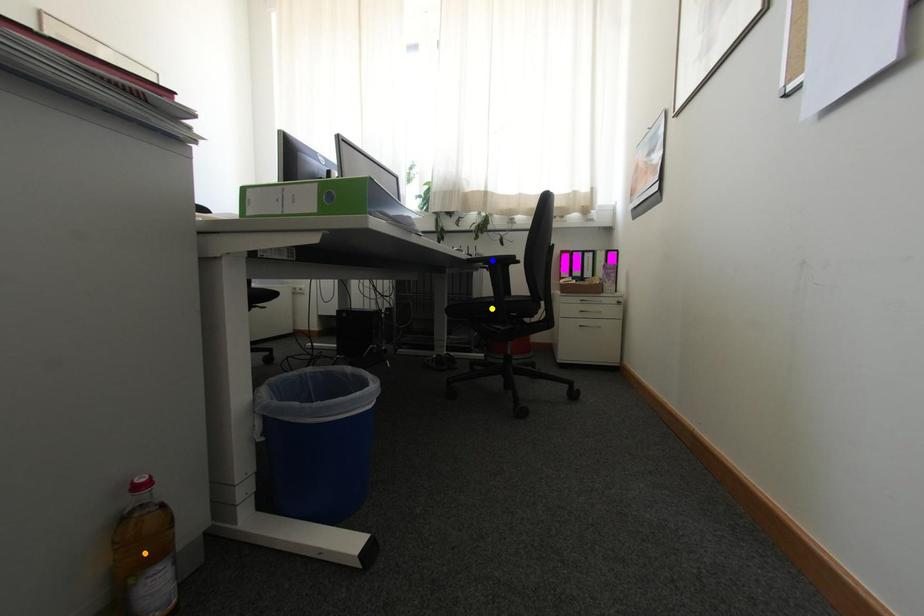
Order these from nearest to farthest:
- blue point
- yellow point
- orange point

orange point → yellow point → blue point